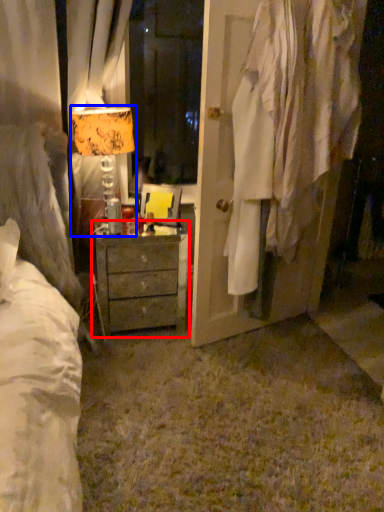
Question: Which object appears closest to the camera in this image, chest of drawers (highlighted by a red box) or table lamp (highlighted by a blue box)?

Choices:
 (A) chest of drawers
 (B) table lamp

Answer: (B)